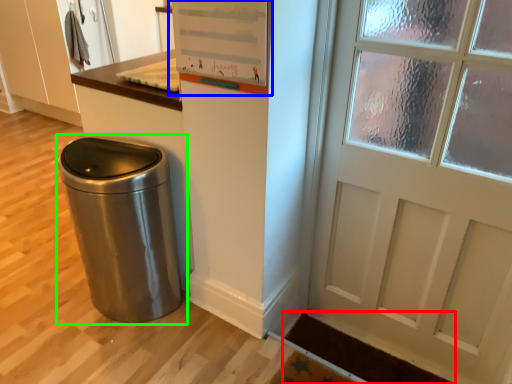
Question: Estimate the real-world distances between objects in this image. Which object is farther from doormat (highlighted by a red box), bulletin board (highlighted by a blue box) or waste container (highlighted by a green box)?

Choices:
 (A) bulletin board
 (B) waste container

Answer: (A)